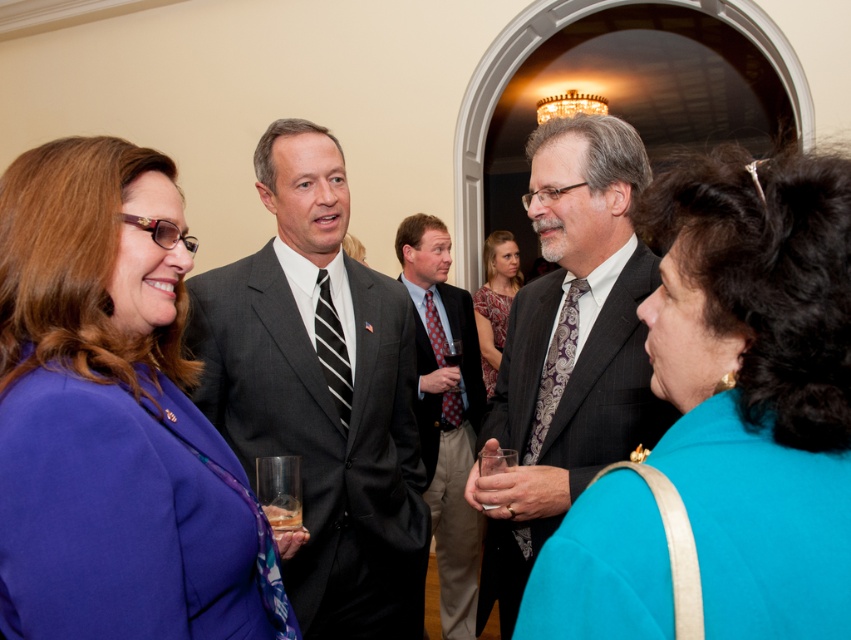
Question: Which of these objects is positioned farthest from the purple paisley tie at center?

Choices:
 (A) printed silk dress at center
 (B) black striped tie at center
 (C) patterned silk tie at center
 (D) patterned tie at center

Answer: (A)

Question: Can you confirm if printed silk dress at center is smaller than black striped tie at center?

Choices:
 (A) yes
 (B) no

Answer: (B)

Question: Is teal fabric purse at center smaller than patterned tie at center?

Choices:
 (A) yes
 (B) no

Answer: (A)

Question: Which object is the farthest from the patterned silk tie at center?

Choices:
 (A) black striped tie at center
 (B) printed silk dress at center
 (C) patterned tie at center
 (D) purple paisley tie at center

Answer: (D)

Question: Which object is farther from the camera taking this photo?

Choices:
 (A) purple fabric jacket at center
 (B) matte gray suit at center

Answer: (B)

Question: Can you confirm if patterned tie at center is positioned above black striped tie at center?

Choices:
 (A) no
 (B) yes

Answer: (A)